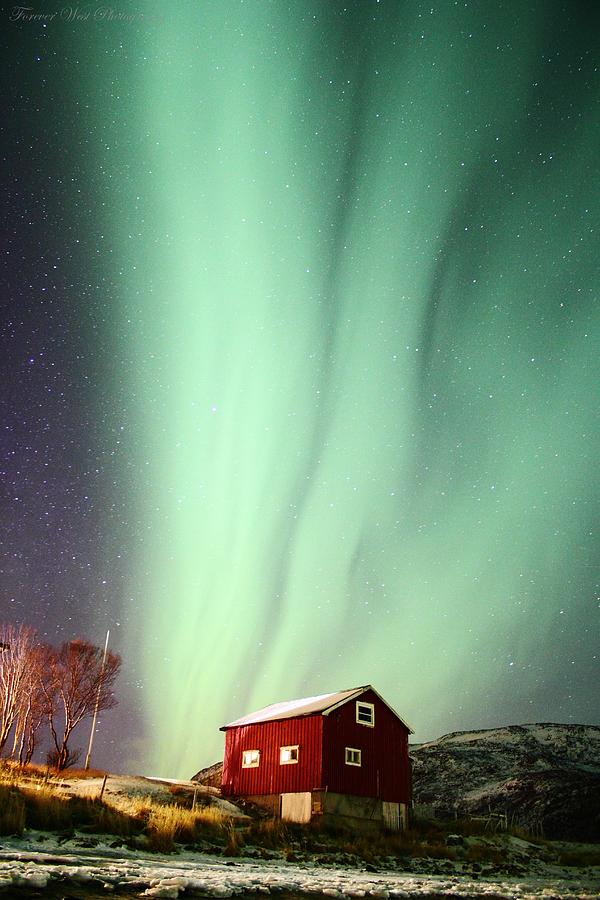
You are a GUI agent. You are given a task and a screenshot of the screen. Output one action in this format:
    pyautogui.click(x=<x>, y=<y>)
    Task: Click on the high window
    The width and height of the screenshot is (600, 900).
    Given the screenshot: What is the action you would take?
    pyautogui.click(x=363, y=715)